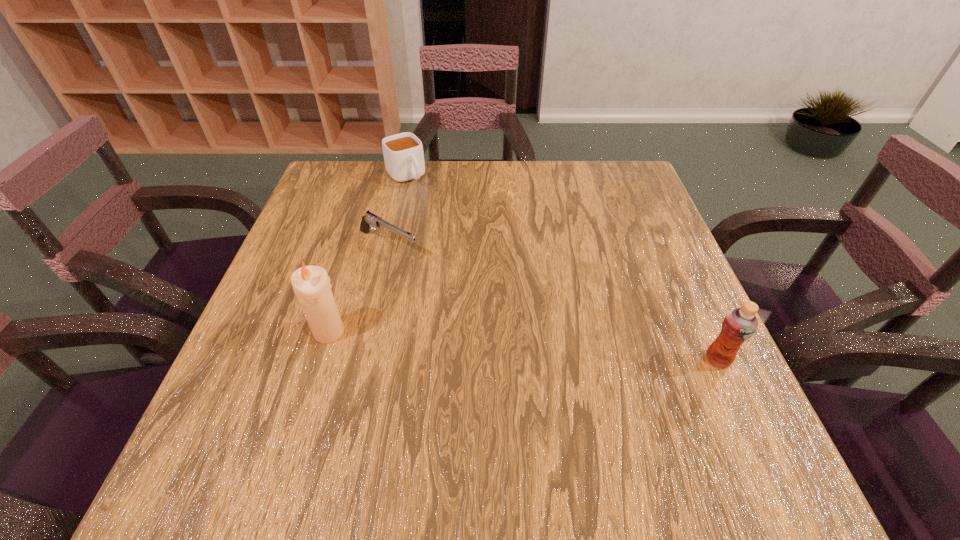
The width and height of the screenshot is (960, 540). In the image, there is a desktop. In order to click on vacant space at the far edge in this screenshot , I will do `click(520, 189)`.

Locate an element on the screen. free space at the near edge is located at coordinates (644, 411).

The height and width of the screenshot is (540, 960). In order to click on vacant space at the left edge of the desktop in this screenshot , I will do `click(324, 211)`.

Where is `vacant space at the right edge of the desktop`? vacant space at the right edge of the desktop is located at coordinates (657, 264).

Identify the location of vacant area at the near left corner. The width and height of the screenshot is (960, 540). (236, 396).

Locate an element on the screen. The height and width of the screenshot is (540, 960). vacant space at the far right corner of the desktop is located at coordinates (x=589, y=196).

Identify the location of free area in between the shortest object and the cup. (396, 211).

At what (x,y) coordinates should I click in order to perform the action: click on vacant area that lies between the nearest object and the shortest object. Please return your answer as a coordinate pair (x, y). This screenshot has width=960, height=540. Looking at the image, I should click on (553, 302).

At what (x,y) coordinates should I click in order to perform the action: click on free space between the orange juice and the candle. Please return your answer as a coordinate pair (x, y). Looking at the image, I should click on (523, 346).

Identify the location of vacant space that's between the farthest object and the rightmost object. This screenshot has height=540, width=960. (562, 268).